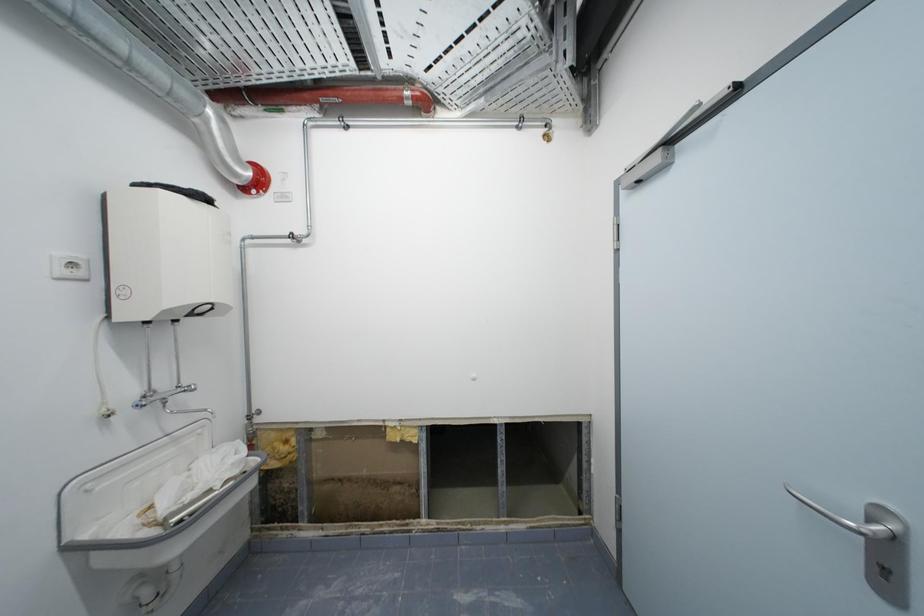
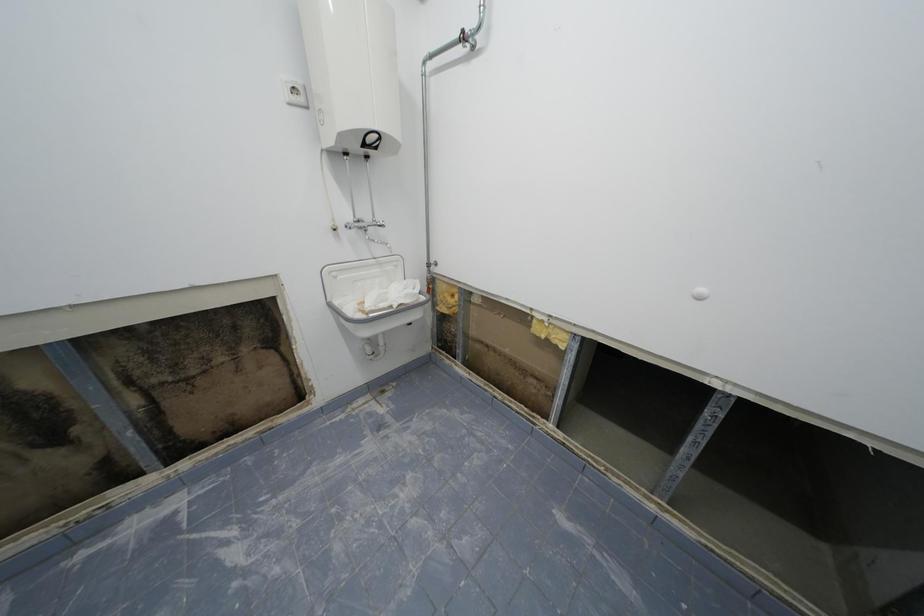
Based on the continuous images, in which direction is the camera rotating?

The camera's rotation is toward left-down.